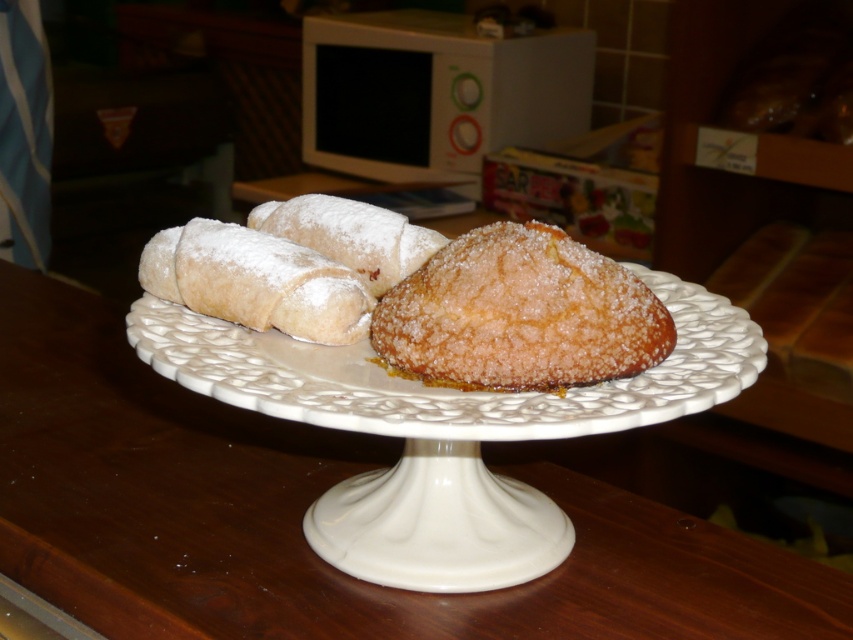
Question: Can you confirm if white ceramic plate at center is bigger than sugared golden brown pastry at center?

Choices:
 (A) yes
 (B) no

Answer: (A)

Question: Does white ceramic plate at center appear on the right side of sugared golden brown pastry at center?

Choices:
 (A) no
 (B) yes

Answer: (A)

Question: Is white ceramic plate at center smaller than sugared golden brown pastry at center?

Choices:
 (A) no
 (B) yes

Answer: (A)

Question: Which object is farther from the camera taking this photo?

Choices:
 (A) white ceramic plate at center
 (B) white ceramic cake stand at center
 (C) sugared golden brown pastry at center

Answer: (C)

Question: Considering the real-world distances, which object is farthest from the sugared golden brown pastry at center?

Choices:
 (A) white ceramic cake stand at center
 (B) white ceramic plate at center

Answer: (A)

Question: Which is farther from the white ceramic cake stand at center?

Choices:
 (A) white ceramic plate at center
 (B) sugared golden brown pastry at center

Answer: (B)